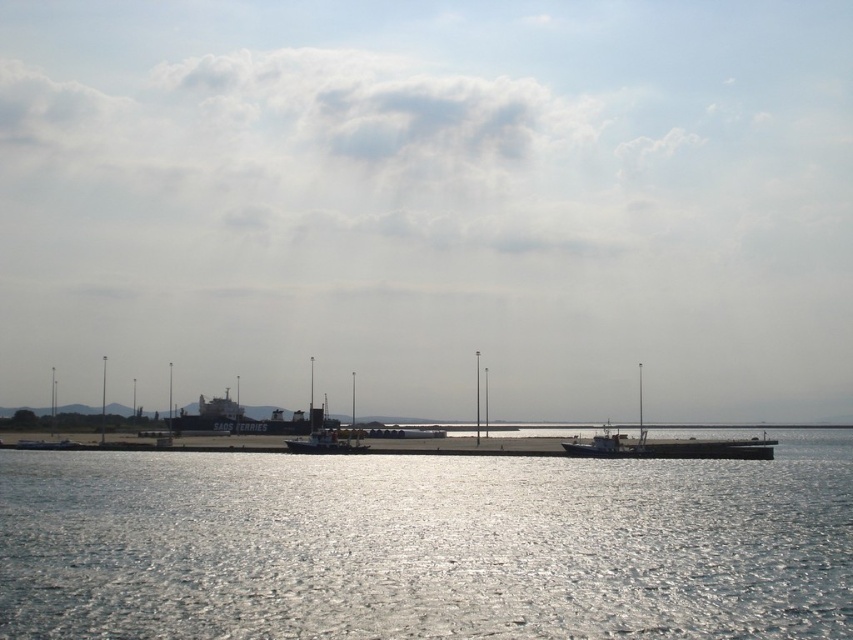
Does metallic gray boat at center have a greater width compared to metallic gray barge at center?

Yes.

Can you confirm if metallic gray boat at center is positioned above metallic gray barge at center?

Incorrect, metallic gray boat at center is not positioned above metallic gray barge at center.

Is point (618, 444) closer to viewer compared to point (732, 440)?

Yes, point (618, 444) is closer to viewer.

Where is `metallic gray boat at center`? This screenshot has height=640, width=853. metallic gray boat at center is located at coordinates [x=665, y=444].

Where is `glistening silver water at center`? This screenshot has height=640, width=853. glistening silver water at center is located at coordinates (426, 545).

Can you confirm if glistening silver water at center is positioned above metallic gray barge at center?

Yes.

Does point (314, 570) come closer to viewer compared to point (577, 444)?

Yes, it is.

Locate an element on the screen. glistening silver water at center is located at coordinates (426, 545).

Between point (515, 500) and point (706, 444), which one is positioned in front?

Point (515, 500)

Is point (99, 636) in front of point (608, 456)?

Yes, point (99, 636) is closer to viewer.

You are a GUI agent. You are given a task and a screenshot of the screen. Output one action in this format:
    pyautogui.click(x=<x>, y=<y>)
    Task: Click on the glistening silver water at center
    
    Given the screenshot: What is the action you would take?
    pyautogui.click(x=426, y=545)